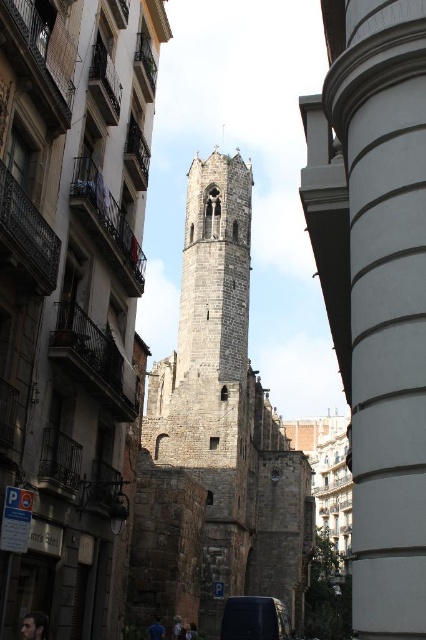
Who is positioned more to the left, dark gray stone tower at center or dark blue matte van at center?

Positioned to the left is dark gray stone tower at center.

Which of these two, dark gray stone tower at center or dark blue matte van at center, stands taller?

dark gray stone tower at center

This screenshot has width=426, height=640. I want to click on dark gray stone tower at center, so click(x=216, y=433).

I want to click on white smooth column at center right, so click(x=385, y=304).

Is white smooth column at center right closer to the viewer compared to dark blue matte van at center?

Yes, white smooth column at center right is in front of dark blue matte van at center.

Image resolution: width=426 pixels, height=640 pixels. What do you see at coordinates (385, 304) in the screenshot?
I see `white smooth column at center right` at bounding box center [385, 304].

The image size is (426, 640). I want to click on white smooth column at center right, so click(385, 304).

Between dark gray stone tower at center and white smooth column at center right, which one has more height?

Standing taller between the two is dark gray stone tower at center.

Which of these two, dark gray stone tower at center or white smooth column at center right, stands shorter?

white smooth column at center right

Describe the element at coordinates (216, 433) in the screenshot. I see `dark gray stone tower at center` at that location.

The width and height of the screenshot is (426, 640). In order to click on dark gray stone tower at center in this screenshot , I will do `click(216, 433)`.